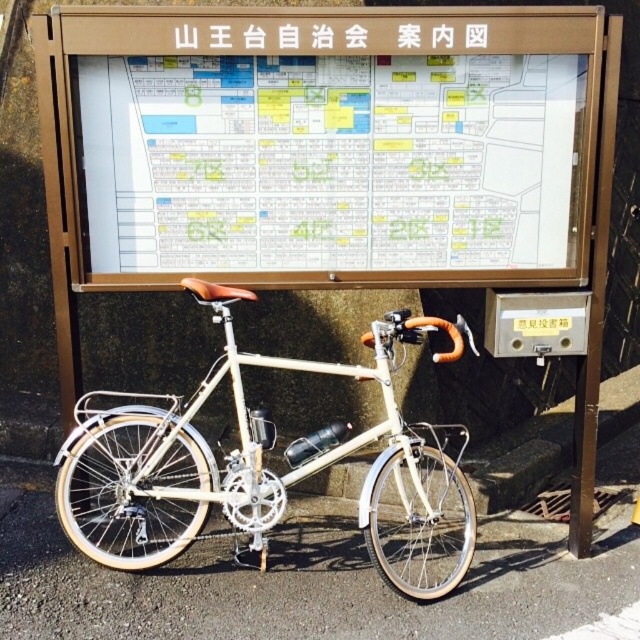
Locate an element on the screen. matte cream bicycle at center is located at coordinates (252, 456).

Is matte cream bicycle at center positioned before white plastic sign at upper center?

Yes, it is.

What do you see at coordinates (252, 456) in the screenshot?
I see `matte cream bicycle at center` at bounding box center [252, 456].

Where is `matte cream bicycle at center`? matte cream bicycle at center is located at coordinates (252, 456).

Does wooden signboard at upper center have a larger size compared to white plastic sign at upper center?

Yes.

Where is `wooden signboard at upper center`? The image size is (640, 640). wooden signboard at upper center is located at coordinates (328, 145).

Which of these two, wooden signboard at upper center or matte cream bicycle at center, stands taller?

matte cream bicycle at center

Who is more forward, (x=364, y=65) or (x=260, y=358)?

Point (x=260, y=358)

Does point (536, 230) come behind point (388, 419)?

Yes, it is.

What are the coordinates of `wooden signboard at upper center` in the screenshot? It's located at (328, 145).